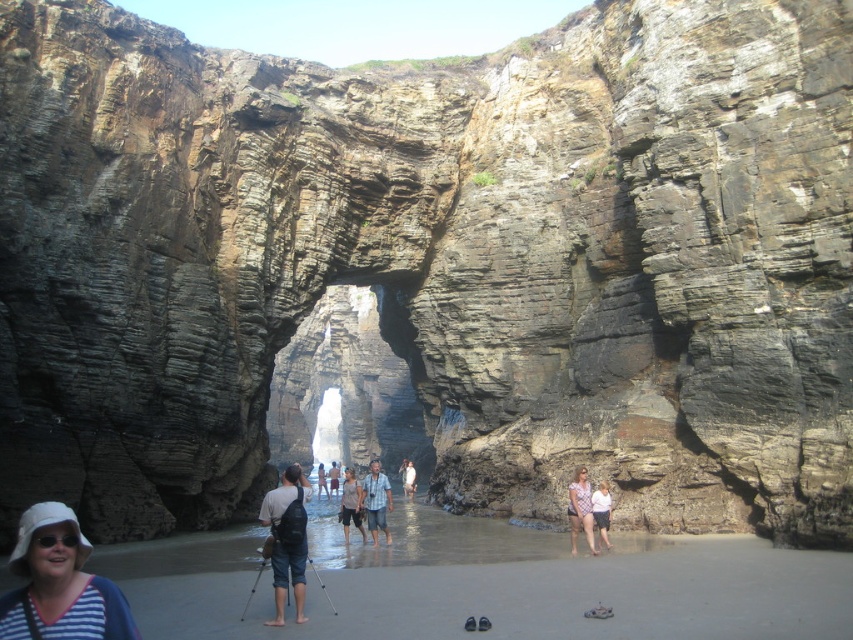
Question: Does natural stone arch at center have a lesser width compared to light pink fabric dress at center?

Choices:
 (A) no
 (B) yes

Answer: (A)

Question: Is light brown leather jacket at center further to the viewer compared to light brown wooden stick at center?

Choices:
 (A) no
 (B) yes

Answer: (A)

Question: Which point is farther to the camera?

Choices:
 (A) white cotton shirt at center
 (B) light brown leather jacket at center
 (C) sandy brown beach at lower center

Answer: (B)

Question: Which of the following is the closest to the observer?

Choices:
 (A) matte black backpack at center
 (B) light brown wooden stick at center
 (C) white fabric hat at lower left

Answer: (C)

Question: Does matte black backpack at center have a larger size compared to white cotton shirt at center?

Choices:
 (A) yes
 (B) no

Answer: (A)

Question: Estimate the real-world distances between objects in this image. Which object is closer to the white fabric hat at lower left?

Choices:
 (A) light brown leather jacket at center
 (B) brown cotton shorts at center
 (C) natural stone arch at center

Answer: (B)